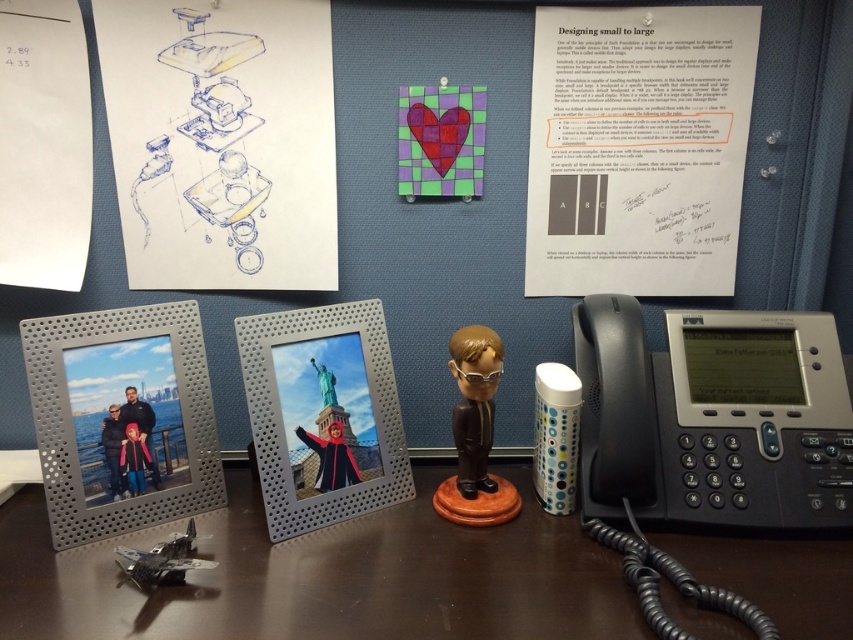
Is point (671, 163) closer to viewer compared to point (474, 346)?

No, (671, 163) is further to viewer.

Who is positioned more to the right, white paper at upper right or shiny brown bobblehead at center?

white paper at upper right is more to the right.

What do you see at coordinates (637, 148) in the screenshot? I see `white paper at upper right` at bounding box center [637, 148].

Locate an element on the screen. The image size is (853, 640). white paper at upper right is located at coordinates (637, 148).

Between blue ink drawing at upper left and white paper at upper right, which one appears on the right side from the viewer's perspective?

Positioned to the right is white paper at upper right.

Who is more forward, (x=165, y=200) or (x=564, y=120)?

Point (x=165, y=200) is in front.

You are a GUI agent. You are given a task and a screenshot of the screen. Output one action in this format:
    pyautogui.click(x=<x>, y=<y>)
    Task: Click on the blue ink drawing at upper left
    
    Given the screenshot: What is the action you would take?
    tap(221, 140)

Is shiny brown bobblehead at center positioned behind metallic silver miniature at lower left?

Yes.

Describe the element at coordinates (474, 403) in the screenshot. I see `shiny brown bobblehead at center` at that location.

Measure the distance between shiny brown bobblehead at center and camera.

shiny brown bobblehead at center is 32.46 inches from camera.

Locate an element on the screen. shiny brown bobblehead at center is located at coordinates (474, 403).